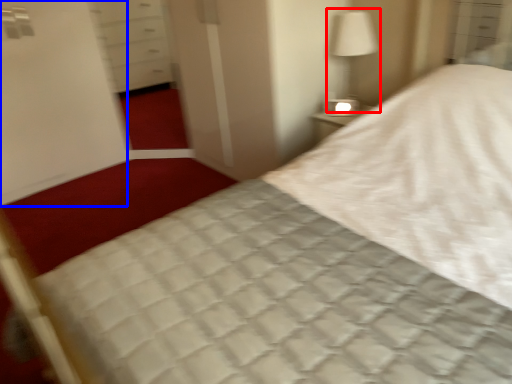
Question: Which object appears closest to the camera in this image, bedside lamp (highlighted by a red box) or screen door (highlighted by a blue box)?

Choices:
 (A) bedside lamp
 (B) screen door

Answer: (A)